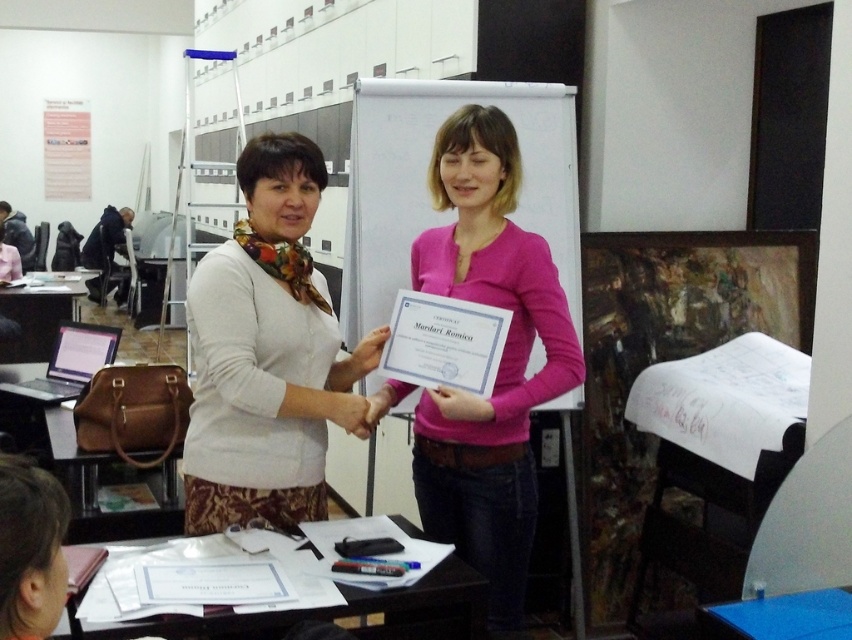
Who is more forward, (255, 257) or (511, 465)?

Point (255, 257) is more forward.

This screenshot has width=852, height=640. I want to click on white matte sweater at center, so (268, 355).